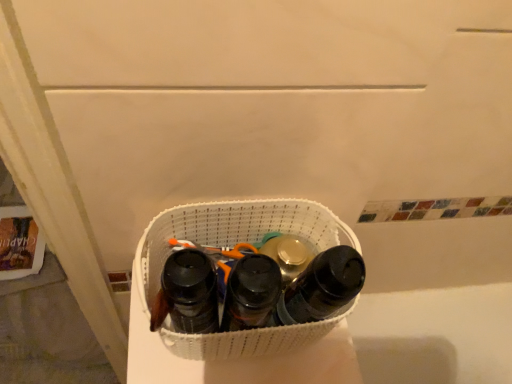
Question: From the image's perspective, is black matte bottle at center, the first footwear in the right-to-left sequence, over black matte water bottle at center, the first footwear when ordered from left to right?

Choices:
 (A) yes
 (B) no

Answer: (A)

Question: Are black matte bottle at center, the first footwear in the right-to-left sequence, and black matte water bottle at center, the 3th footwear positioned from the right, located far from each other?

Choices:
 (A) no
 (B) yes

Answer: (A)

Question: Is black matte bottle at center, which is the 3th footwear from left to right, shorter than black matte water bottle at center, the 3th footwear positioned from the right?

Choices:
 (A) no
 (B) yes

Answer: (A)

Question: Could you tell me if black matte bottle at center, the first footwear in the right-to-left sequence, is turned towards black matte water bottle at center, the first footwear when ordered from left to right?

Choices:
 (A) yes
 (B) no

Answer: (B)

Question: Does black matte bottle at center, which is the 3th footwear from left to right, have a greater height compared to black matte water bottle at center, the 3th footwear positioned from the right?

Choices:
 (A) no
 (B) yes

Answer: (B)

Question: In the image, is black matte bottle at center, which is the 3th footwear from left to right, on the left side or the right side of black matte shoe at center, the 2th footwear viewed from the right?

Choices:
 (A) left
 (B) right

Answer: (B)

Question: In terms of width, does black matte bottle at center, the first footwear in the right-to-left sequence, look wider or thinner when compared to black matte shoe at center, which is the second footwear in left-to-right order?

Choices:
 (A) wide
 (B) thin

Answer: (B)

Question: From the image's perspective, is black matte bottle at center, the first footwear in the right-to-left sequence, above or below black matte shoe at center, the 2th footwear viewed from the right?

Choices:
 (A) above
 (B) below

Answer: (A)

Question: Is black matte bottle at center, the first footwear in the right-to-left sequence, bigger or smaller than black matte shoe at center, which is the second footwear in left-to-right order?

Choices:
 (A) big
 (B) small

Answer: (B)

Question: Do you think black matte shoe at center, which is the second footwear in left-to-right order, is within black matte bottle at center, the first footwear in the right-to-left sequence, or outside of it?

Choices:
 (A) inside
 (B) outside

Answer: (B)

Question: From the image's perspective, is black matte shoe at center, which is the second footwear in left-to-right order, positioned above or below black matte bottle at center, the first footwear in the right-to-left sequence?

Choices:
 (A) below
 (B) above

Answer: (A)

Question: In terms of height, does black matte shoe at center, the 2th footwear viewed from the right, look taller or shorter compared to black matte bottle at center, the first footwear in the right-to-left sequence?

Choices:
 (A) tall
 (B) short

Answer: (B)

Question: Considering the positions of point (249, 302) and point (345, 284), is point (249, 302) closer or farther from the camera than point (345, 284)?

Choices:
 (A) farther
 (B) closer

Answer: (B)

Question: From a real-world perspective, is black matte bottle at center, which is the 3th footwear from left to right, above or below white woven laundry basket at center?

Choices:
 (A) below
 (B) above

Answer: (B)

Question: From the image's perspective, is black matte bottle at center, which is the 3th footwear from left to right, positioned above or below white woven laundry basket at center?

Choices:
 (A) above
 (B) below

Answer: (B)